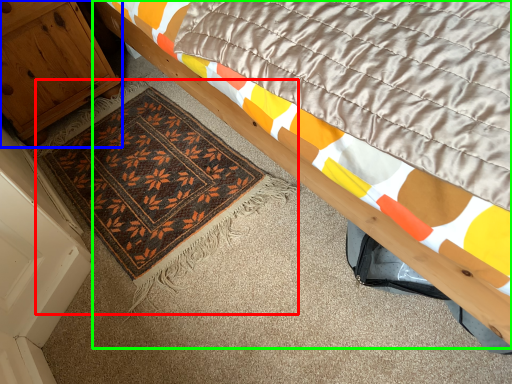
Question: Estimate the real-world distances between objects in this image. Which object is farther from mat (highlighted by a red box), cabinetry (highlighted by a blue box) or bed (highlighted by a green box)?

Choices:
 (A) cabinetry
 (B) bed

Answer: (B)